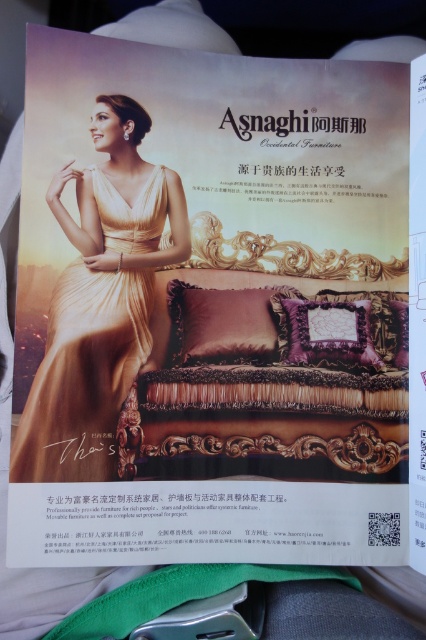
Locate an element on the screen. The image size is (426, 640). gold satin dress at left is located at coordinates (83, 374).

Between gold satin dress at left and velvet purple pillow at center, which one appears on the right side from the viewer's perspective?

velvet purple pillow at center is more to the right.

Locate an element on the screen. gold satin dress at left is located at coordinates (83, 374).

Is satin purple pillow at center to the left of velvet purple pillow at center from the viewer's perspective?

Correct, you'll find satin purple pillow at center to the left of velvet purple pillow at center.

Can you confirm if satin purple pillow at center is taller than velvet purple pillow at center?

Indeed, satin purple pillow at center has a greater height compared to velvet purple pillow at center.

Is point (170, 339) positioned behind point (344, 352)?

No, (170, 339) is in front of (344, 352).

Identify the location of satin purple pillow at center. This screenshot has height=640, width=426. (227, 324).

Is gold satin dress at left bigger than satin purple pillow at center?

Indeed, gold satin dress at left has a larger size compared to satin purple pillow at center.

Which is in front, point (121, 332) or point (213, 323)?

Positioned in front is point (121, 332).

Is point (106, 180) positioned before point (230, 314)?

That is True.

I want to click on gold satin dress at left, so click(83, 374).